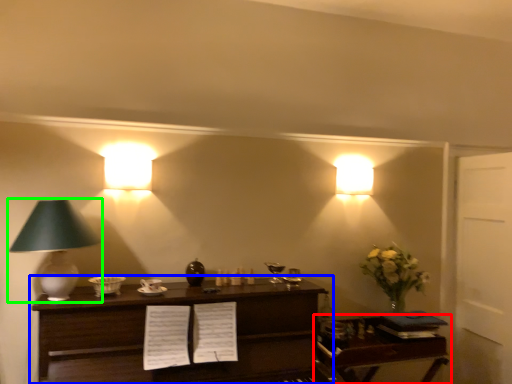
Question: Which is nearer to the table (highlighted by a red box)? table (highlighted by a blue box) or lamp (highlighted by a green box).

Choices:
 (A) table
 (B) lamp

Answer: (A)